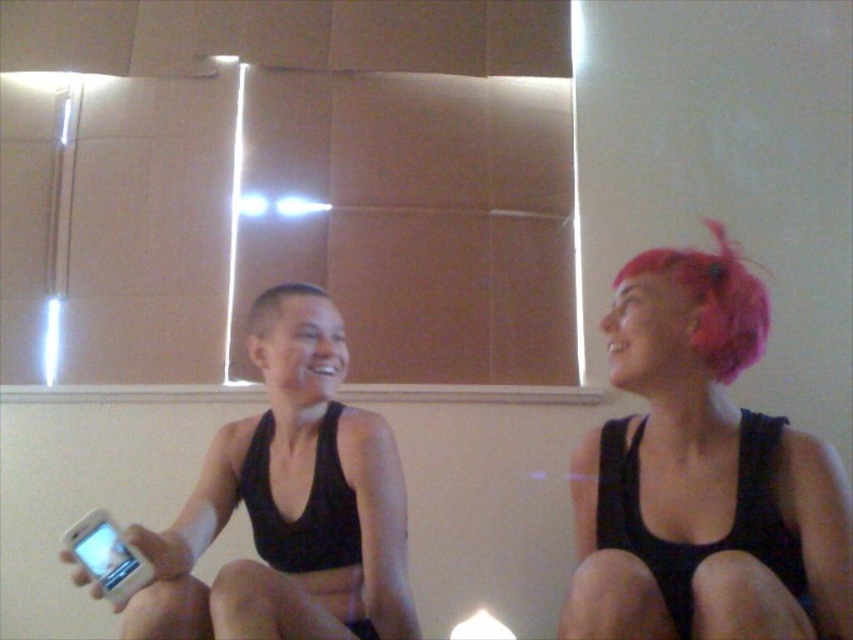
You are an interior designer planning to install a new light fixture in this room. The current light fixtures are embedded in the tiled section above the individuals. Where should you place the new light fixture to avoid shining directly into the eyes of the person sitting at point (701, 476)?

The new light fixture should be placed away from the area directly above the person sitting at point (701, 476) to avoid shining into their eyes.

You are a photographer setting up a shoot in this scene. You need to ensure that the black matte tank top at center and the pink fluffy hair at upper right are both visible in the frame. Based on their positions, which object should you focus on first to ensure both are in focus?

The black matte tank top at center is positioned under the pink fluffy hair at upper right. To ensure both are in focus, you should focus on the pink fluffy hair at upper right first since it is farther away, allowing the depth of field to include the closer black matte tank top at center.